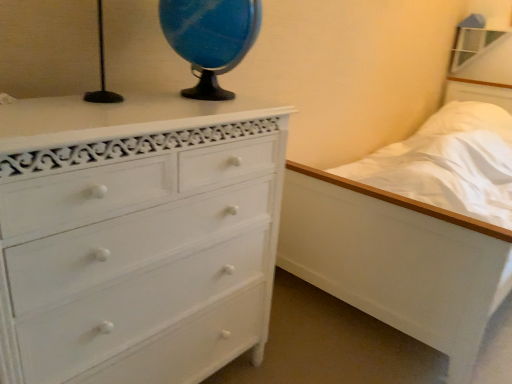
Measure the distance between point (508,261) and camera.

4.62 feet.

You are a GUI agent. You are given a task and a screenshot of the screen. Output one action in this format:
    pyautogui.click(x=<x>, y=<y>)
    Task: Click on the blue marble globe at upper center
    Image resolution: width=512 pixels, height=384 pixels.
    Given the screenshot: What is the action you would take?
    pyautogui.click(x=210, y=38)

Measure the distance from blue marble globe at upper center to white wooden bed at right.

The distance of blue marble globe at upper center from white wooden bed at right is 85.83 centimeters.

Can you confirm if blue marble globe at upper center is positioned to the left of white wooden bed at right?

Yes.

Is blue marble globe at upper center beside white wooden bed at right?

No, blue marble globe at upper center is not in contact with white wooden bed at right.

Considering the relative sizes of blue marble globe at upper center and white wooden bed at right in the image provided, is blue marble globe at upper center wider than white wooden bed at right?

In fact, blue marble globe at upper center might be narrower than white wooden bed at right.

Considering the sizes of blue marble globe at upper center and white painted wood chest of drawers at left in the image, is blue marble globe at upper center bigger or smaller than white painted wood chest of drawers at left?

Clearly, blue marble globe at upper center is smaller in size than white painted wood chest of drawers at left.

From the picture: Does blue marble globe at upper center appear on the left side of white painted wood chest of drawers at left?

No.

Can you tell me how much blue marble globe at upper center and white painted wood chest of drawers at left differ in facing direction?

0.00178 degrees separate the facing orientations of blue marble globe at upper center and white painted wood chest of drawers at left.

Looking at this image, is blue marble globe at upper center wider or thinner than white painted wood chest of drawers at left?

blue marble globe at upper center is thinner than white painted wood chest of drawers at left.

Is white wooden bed at right next to white painted wood chest of drawers at left?

white wooden bed at right is not next to white painted wood chest of drawers at left, and they're not touching.

Looking at this image, is white wooden bed at right in front of white painted wood chest of drawers at left?

No.

Which is nearer, (364, 278) or (93, 350)?

Point (364, 278) is positioned farther from the camera compared to point (93, 350).

Is blue marble globe at upper center completely or partially inside white wooden bed at right?

No.

Can you confirm if white wooden bed at right is bigger than blue marble globe at upper center?

Yes.

From the image's perspective, is white wooden bed at right positioned above or below blue marble globe at upper center?

Based on their image positions, white wooden bed at right is located beneath blue marble globe at upper center.

Is point (391, 300) more distant than point (260, 11)?

Yes, it is.

Considering the relative positions of white painted wood chest of drawers at left and blue marble globe at upper center in the image provided, is white painted wood chest of drawers at left to the left or to the right of blue marble globe at upper center?

white painted wood chest of drawers at left is to the left of blue marble globe at upper center.

Which of these two, white painted wood chest of drawers at left or blue marble globe at upper center, stands shorter?

blue marble globe at upper center is shorter.

Can you confirm if white painted wood chest of drawers at left is thinner than blue marble globe at upper center?

In fact, white painted wood chest of drawers at left might be wider than blue marble globe at upper center.

How distant is white painted wood chest of drawers at left from blue marble globe at upper center?

A distance of 15.17 inches exists between white painted wood chest of drawers at left and blue marble globe at upper center.

Between point (56, 253) and point (385, 232), which one is positioned behind?

The point (385, 232) is farther.

In the scene shown: Considering the relative sizes of white painted wood chest of drawers at left and white wooden bed at right in the image provided, is white painted wood chest of drawers at left shorter than white wooden bed at right?

Answer: No, white painted wood chest of drawers at left is not shorter than white wooden bed at right.

From a real-world perspective, is white painted wood chest of drawers at left physically located above or below white wooden bed at right?

white painted wood chest of drawers at left is situated higher than white wooden bed at right in the real world.

Does white painted wood chest of drawers at left lie behind white wooden bed at right?

No.

Locate an element on the screen. The image size is (512, 384). bed behind the blue marble globe at upper center is located at coordinates (397, 260).

At what (x,y) coordinates should I click in order to perform the action: click on chest of drawers below the blue marble globe at upper center (from a real-world perspective). Please return your answer as a coordinate pair (x, y). Image resolution: width=512 pixels, height=384 pixels. Looking at the image, I should click on (136, 237).

From the image, which object appears to be nearer to white painted wood chest of drawers at left, blue marble globe at upper center or white wooden bed at right?

blue marble globe at upper center is closer to white painted wood chest of drawers at left.

From the image, which object appears to be nearer to blue marble globe at upper center, white painted wood chest of drawers at left or white wooden bed at right?

Based on the image, white painted wood chest of drawers at left appears to be nearer to blue marble globe at upper center.

Based on their spatial positions, is white painted wood chest of drawers at left or blue marble globe at upper center closer to white wooden bed at right?

white painted wood chest of drawers at left.

From the image, which object appears to be farther from blue marble globe at upper center, white wooden bed at right or white painted wood chest of drawers at left?

Among the two, white wooden bed at right is located further to blue marble globe at upper center.

Considering their positions, is blue marble globe at upper center positioned closer to white wooden bed at right than white painted wood chest of drawers at left?

Among the two, white painted wood chest of drawers at left is located nearer to white wooden bed at right.

From the image, which object appears to be farther from white painted wood chest of drawers at left, white wooden bed at right or blue marble globe at upper center?

white wooden bed at right is positioned further to the anchor white painted wood chest of drawers at left.

At what (x,y) coordinates should I click in order to perform the action: click on table lamp between white painted wood chest of drawers at left and white wooden bed at right from left to right. Please return your answer as a coordinate pair (x, y). This screenshot has height=384, width=512. Looking at the image, I should click on pyautogui.click(x=210, y=38).